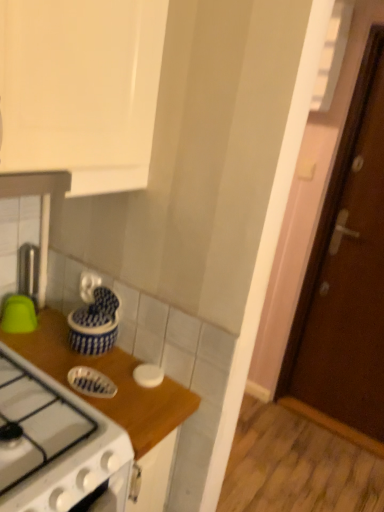
Find the location of a particular element. This screenshot has height=512, width=384. free location to the right of green matte bowl at left, acting as the fourth kitchen appliance starting from the right is located at coordinates (66, 340).